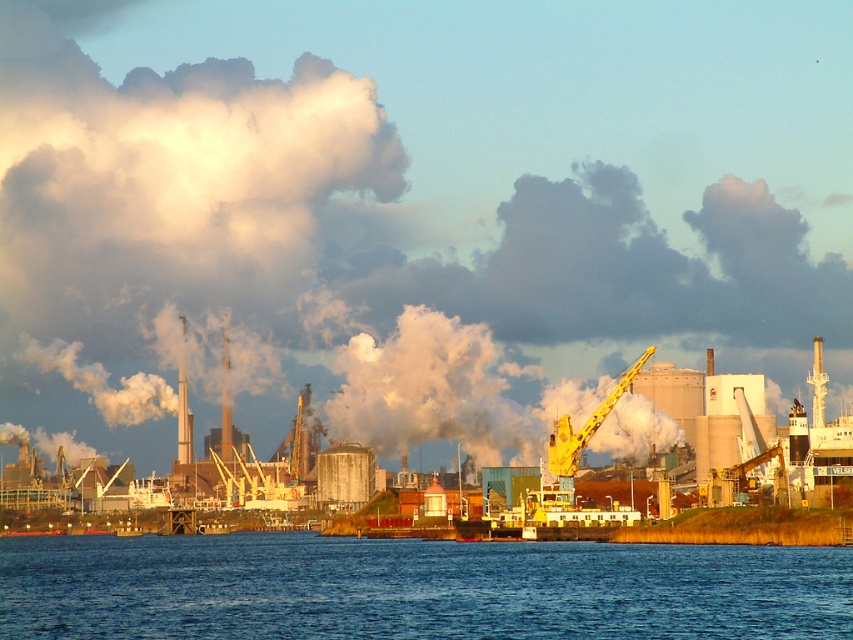
Between blue liquid water at lower center and yellow metallic crane at center, which one is positioned higher?

Positioned higher is yellow metallic crane at center.

Measure the distance from blue liquid water at lower center to yellow metallic crane at center.

62.88 meters

Does point (138, 552) come in front of point (567, 460)?

No.

In order to click on blue liquid water at lower center in this screenshot , I will do `click(415, 588)`.

Who is positioned more to the left, white smoke at upper center or blue liquid water at lower center?

blue liquid water at lower center

Which is more to the right, white smoke at upper center or blue liquid water at lower center?

Positioned to the right is white smoke at upper center.

Is point (193, 250) behind point (366, 560)?

Yes, it is.

In order to click on white smoke at upper center in this screenshot , I will do `click(410, 209)`.

Does white smoke at upper center have a lesser width compared to yellow metallic crane at center?

No.

Between point (711, 35) and point (567, 429), which one is positioned behind?

The point (711, 35) is behind.

Image resolution: width=853 pixels, height=640 pixels. In order to click on white smoke at upper center in this screenshot , I will do `click(410, 209)`.